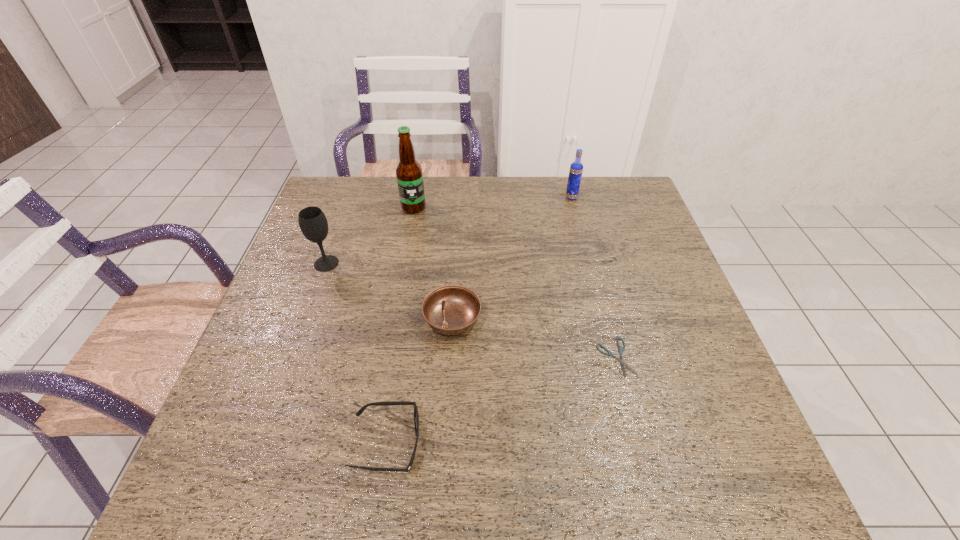
At what (x,y) coordinates should I click in order to perform the action: click on vacant space at the right edge of the desktop. Please return your answer as a coordinate pair (x, y). The width and height of the screenshot is (960, 540). Looking at the image, I should click on (686, 365).

Locate an element on the screen. The image size is (960, 540). free location at the near left corner of the desktop is located at coordinates (273, 499).

The height and width of the screenshot is (540, 960). In order to click on vacant space at the far right corner of the desktop in this screenshot , I will do `click(634, 190)`.

This screenshot has height=540, width=960. In order to click on vacant point located between the vodka and the beer bottle in this screenshot , I will do `click(492, 202)`.

This screenshot has width=960, height=540. In order to click on free space between the wineglass and the nearest object in this screenshot , I will do `click(356, 354)`.

Identify the location of vacant space that's between the nearest object and the tallest object. (400, 326).

Identify the location of free space between the tallest object and the leftmost object. (370, 235).

Locate an element on the screen. The width and height of the screenshot is (960, 540). vacant area that lies between the vodka and the shortest object is located at coordinates (593, 278).

At what (x,y) coordinates should I click in order to perform the action: click on free point between the soup bowl and the shears. Please return your answer as a coordinate pair (x, y). This screenshot has width=960, height=540. Looking at the image, I should click on (534, 339).

Where is `unoccupied position between the vodka and the tallest object`? unoccupied position between the vodka and the tallest object is located at coordinates (492, 202).